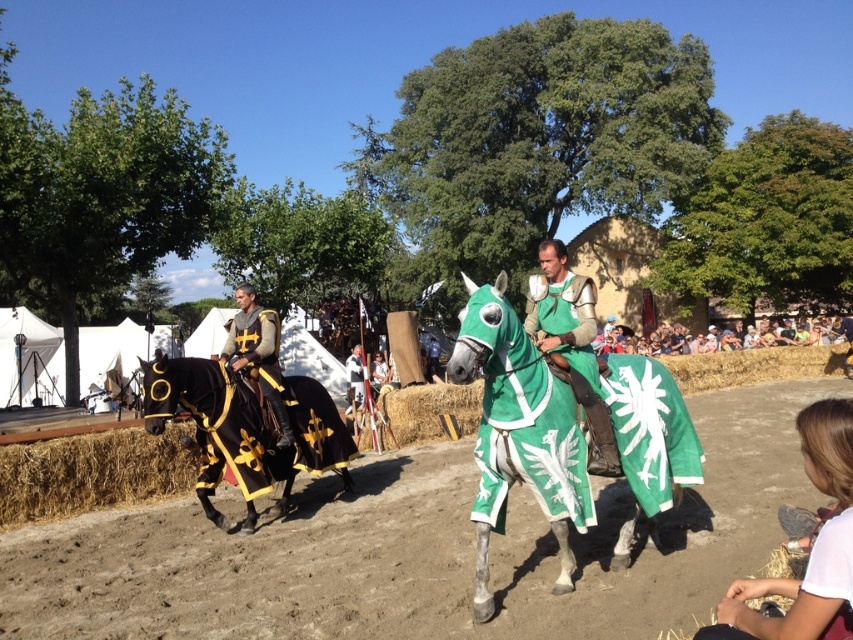
Question: Can you confirm if green fabric horse at center is smaller than green felt hay at center?

Choices:
 (A) no
 (B) yes

Answer: (A)

Question: Among these points, which one is nearest to the camera?

Choices:
 (A) (274, 330)
 (B) (676, 456)
 (C) (846, 422)
 (D) (339, 532)

Answer: (C)

Question: Does green fabric horse at center come in front of green matte armor at center?

Choices:
 (A) yes
 (B) no

Answer: (A)

Question: Which object is positioned closest to the black velvet armor at center?

Choices:
 (A) white cotton shirt at lower right
 (B) black velvet horse at left
 (C) green matte armor at center
 (D) dirt field at center

Answer: (B)

Question: Which point appears farthest from the camera in this image?

Choices:
 (A) (840, 458)
 (B) (3, 534)

Answer: (B)

Question: Does green fabric horse at center have a greater width compared to green felt hay at center?

Choices:
 (A) yes
 (B) no

Answer: (B)